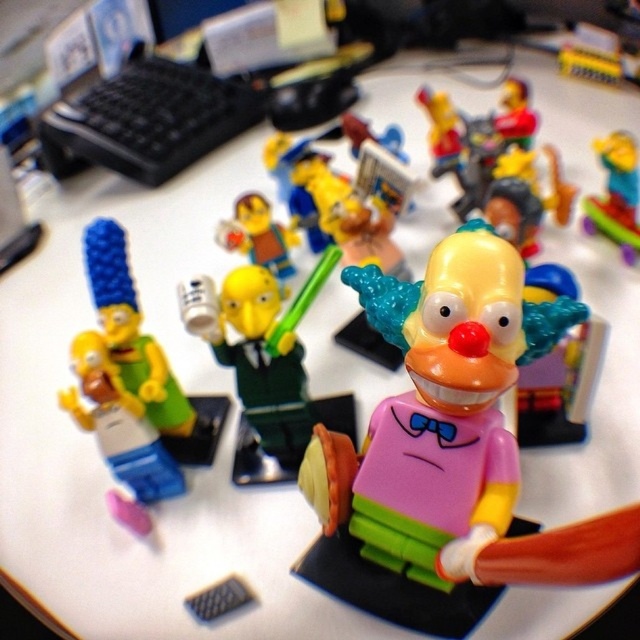
Question: Which point is farther to the camera?

Choices:
 (A) (253, 257)
 (B) (477, 259)
 (C) (602, 145)

Answer: (A)

Question: Which of the following is the farthest from the observer?

Choices:
 (A) (275, 227)
 (B) (589, 198)
 (C) (296, 442)
 (D) (420, 577)

Answer: (B)

Question: Which point appears closest to the camera in this image?

Choices:
 (A) (598, 138)
 (B) (284, 355)
 (C) (237, 244)

Answer: (B)

Question: Is translucent yellow clown at center below translucent yellow figure at center?

Choices:
 (A) yes
 (B) no

Answer: (B)

Question: Can you confirm if pink matte clown at center is thinner than translucent yellow figure at center?

Choices:
 (A) yes
 (B) no

Answer: (B)

Question: Does pink matte clown at center appear over translucent yellow clown at center?

Choices:
 (A) no
 (B) yes

Answer: (A)